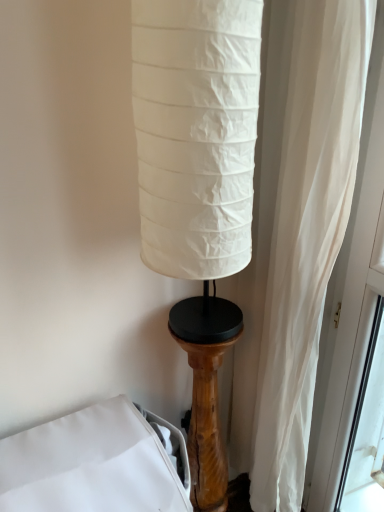
At what (x,y) coordinates should I click in order to perform the action: click on wooden pedestal at lower right. Please return your answer as a coordinate pair (x, y). The width and height of the screenshot is (384, 512). Looking at the image, I should click on (206, 389).

The height and width of the screenshot is (512, 384). What do you see at coordinates (206, 389) in the screenshot? I see `wooden pedestal at lower right` at bounding box center [206, 389].

Locate an element on the screen. white fabric bed at lower left is located at coordinates (90, 464).

In order to face white fabric bed at lower left, should I rotate leftwards or rightwards?

It's best to rotate left around 11.234 degrees.

Describe the element at coordinates (90, 464) in the screenshot. This screenshot has height=512, width=384. I see `white fabric bed at lower left` at that location.

Locate an element on the screen. This screenshot has height=512, width=384. wooden pedestal at lower right is located at coordinates (206, 389).

Can you confirm if white fabric bed at lower left is positioned to the left of wooden pedestal at lower right?

Correct, you'll find white fabric bed at lower left to the left of wooden pedestal at lower right.

Consider the image. Considering the relative positions of white fabric bed at lower left and wooden pedestal at lower right in the image provided, is white fabric bed at lower left in front of wooden pedestal at lower right?

Yes, white fabric bed at lower left is in front of wooden pedestal at lower right.

Is point (120, 432) more distant than point (197, 506)?

No, it is in front of (197, 506).

From the image's perspective, is white fabric bed at lower left below wooden pedestal at lower right?

Indeed, from the image's perspective, white fabric bed at lower left is shown beneath wooden pedestal at lower right.

From a real-world perspective, which is physically below, white fabric bed at lower left or wooden pedestal at lower right?

white fabric bed at lower left, from a real-world perspective.

Which of these two, white fabric bed at lower left or wooden pedestal at lower right, is thinner?

wooden pedestal at lower right.

From their relative heights in the image, would you say white fabric bed at lower left is taller or shorter than wooden pedestal at lower right?

white fabric bed at lower left is shorter than wooden pedestal at lower right.

Between white fabric bed at lower left and wooden pedestal at lower right, which one has smaller size?

wooden pedestal at lower right.

Would you say white fabric bed at lower left contains wooden pedestal at lower right?

No, wooden pedestal at lower right is not a part of white fabric bed at lower left.

Are white fabric bed at lower left and wooden pedestal at lower right located far from each other?

They are positioned close to each other.

Is white fabric bed at lower left turned away from wooden pedestal at lower right?

white fabric bed at lower left does not have its back to wooden pedestal at lower right.

Measure the distance from white fabric bed at lower left to wooden pedestal at lower right.

white fabric bed at lower left and wooden pedestal at lower right are 29.13 centimeters apart.

Where is `pillar above the white fabric bed at lower left (from a real-world perspective)`? pillar above the white fabric bed at lower left (from a real-world perspective) is located at coordinates (206, 389).

Is wooden pedestal at lower right to the right of white fabric bed at lower left from the viewer's perspective?

Correct, you'll find wooden pedestal at lower right to the right of white fabric bed at lower left.

From the picture: Relative to white fabric bed at lower left, is wooden pedestal at lower right in front or behind?

wooden pedestal at lower right is behind white fabric bed at lower left.

Is point (202, 417) positioned behind point (5, 454)?

Yes, it is behind point (5, 454).

From the image's perspective, between wooden pedestal at lower right and white fabric bed at lower left, who is located below?

From the image's view, white fabric bed at lower left is below.

From a real-world perspective, which object rests below the other?

white fabric bed at lower left is physically lower.

In the scene shown: Is wooden pedestal at lower right wider or thinner than white fabric bed at lower left?

Considering their sizes, wooden pedestal at lower right looks slimmer than white fabric bed at lower left.

Who is taller, wooden pedestal at lower right or white fabric bed at lower left?

wooden pedestal at lower right.

Is wooden pedestal at lower right bigger or smaller than white fabric bed at lower left?

Clearly, wooden pedestal at lower right is smaller in size than white fabric bed at lower left.

Which is correct: wooden pedestal at lower right is inside white fabric bed at lower left, or outside of it?

wooden pedestal at lower right is outside white fabric bed at lower left.

Would you consider wooden pedestal at lower right to be distant from white fabric bed at lower left?

No, wooden pedestal at lower right is not far from white fabric bed at lower left.

Is wooden pedestal at lower right oriented towards white fabric bed at lower left?

No, wooden pedestal at lower right does not turn towards white fabric bed at lower left.

The image size is (384, 512). I want to click on furniture in front of the wooden pedestal at lower right, so click(90, 464).

Find the location of a particular element. This screenshot has height=512, width=384. furniture in front of the wooden pedestal at lower right is located at coordinates (90, 464).

Find the location of a particular element. This screenshot has width=384, height=512. pillar that appears on the right of white fabric bed at lower left is located at coordinates coord(206,389).